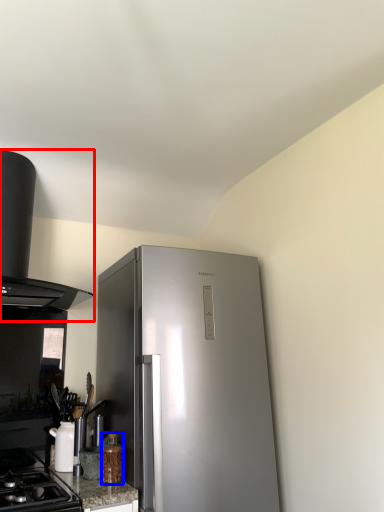
Question: Which point is further to the camera, kitchen appliance (highlighted by a red box) or bottle (highlighted by a blue box)?

Choices:
 (A) kitchen appliance
 (B) bottle

Answer: (B)